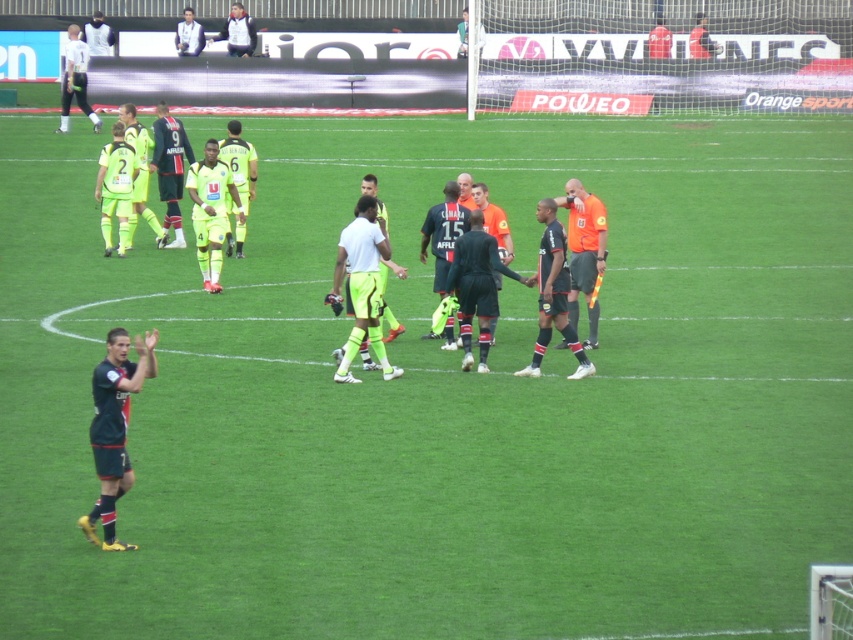
Question: Estimate the real-world distances between objects in this image. Which object is farther from the neon yellow shorts at center?

Choices:
 (A) black jersey at center
 (B) white cotton shirt at upper center

Answer: (B)

Question: Observing the image, what is the correct spatial positioning of black matte suit at center in reference to white matte shirt at center?

Choices:
 (A) above
 (B) below

Answer: (B)

Question: Which point appears farthest from the camera in this image?

Choices:
 (A) (136, 140)
 (B) (346, 310)
 (C) (155, 108)
 (D) (560, 278)

Answer: (C)

Question: Is dark green jersey at center further to camera compared to white matte shirt at center?

Choices:
 (A) yes
 (B) no

Answer: (A)

Question: Estimate the real-world distances between objects in this image. Which object is closer to the white matte referee at upper left?

Choices:
 (A) black matte suit at center
 (B) neon yellow jersey at center
 (C) dark green jersey at center
 (D) white matte shirt at center

Answer: (C)

Question: Can you confirm if dark blue jersey at center is positioned to the left of white matte shirt at center?

Choices:
 (A) no
 (B) yes

Answer: (B)